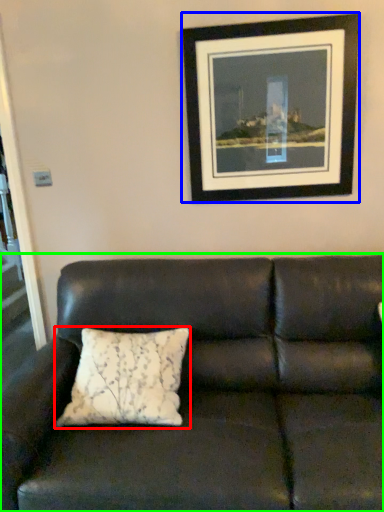
Question: Which object is the closest to the pillow (highlighted by a red box)? Choose among these: picture frame (highlighted by a blue box) or studio couch (highlighted by a green box).

Choices:
 (A) picture frame
 (B) studio couch

Answer: (B)